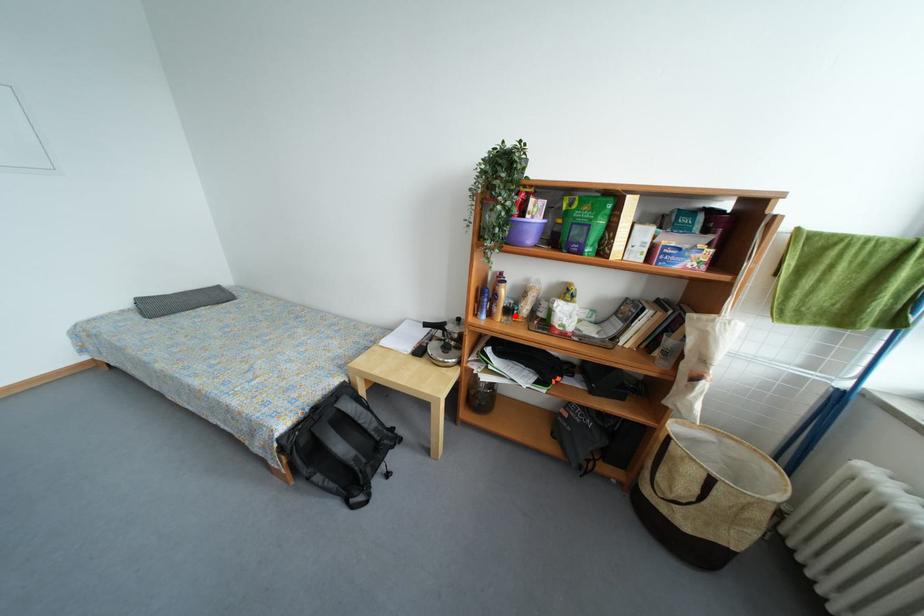
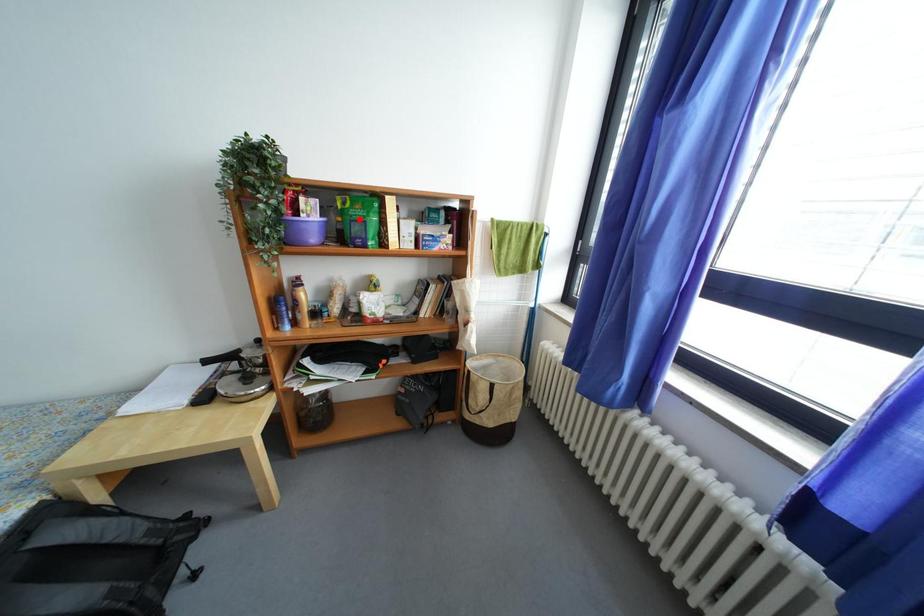
I am providing you with two images of the same scene from different viewpoints. A red point is marked on the first image and another point is marked on the second image. Is the red point in image1 aligned with the point shown in image2?

No